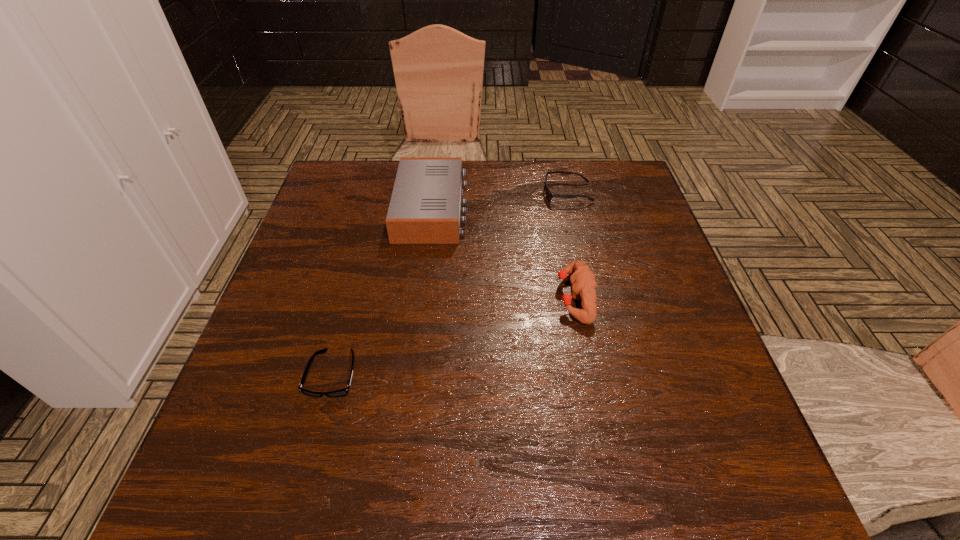
This screenshot has height=540, width=960. Find the location of `vacant region located on the front-facing side of the second shortest object`. vacant region located on the front-facing side of the second shortest object is located at coordinates (428, 193).

Locate an element on the screen. vacant space located on the front-facing side of the second shortest object is located at coordinates (519, 193).

This screenshot has height=540, width=960. What are the coordinates of `vacant region located on the front-facing side of the second shortest object` in the screenshot? It's located at (481, 193).

I want to click on blank area located on the front-facing side of the left sunglasses, so click(x=301, y=492).

The height and width of the screenshot is (540, 960). I want to click on radio receiver situated at the far edge, so click(425, 208).

Locate an element on the screen. sunglasses that is at the far edge is located at coordinates tap(549, 194).

Image resolution: width=960 pixels, height=540 pixels. What are the coordinates of `object present at the left edge` in the screenshot? It's located at (342, 392).

Find the location of a particular element. This screenshot has width=960, height=540. object at the right edge is located at coordinates (549, 194).

At what (x,y) coordinates should I click in order to perform the action: click on object that is at the far right corner. Please return your answer as a coordinate pair (x, y). Looking at the image, I should click on click(x=549, y=194).

Identify the location of free space at the far edge of the desktop. (564, 168).